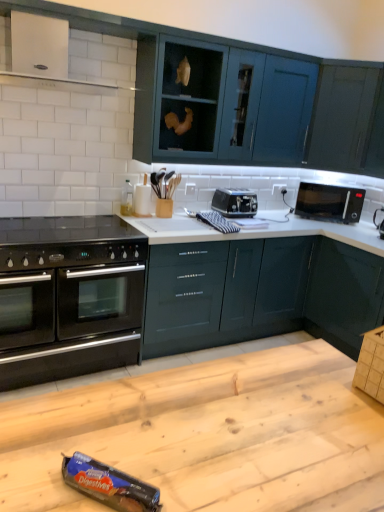
Find the location of `vacant area that is in front of brown cardboard box at lower right`. vacant area that is in front of brown cardboard box at lower right is located at coordinates (369, 415).